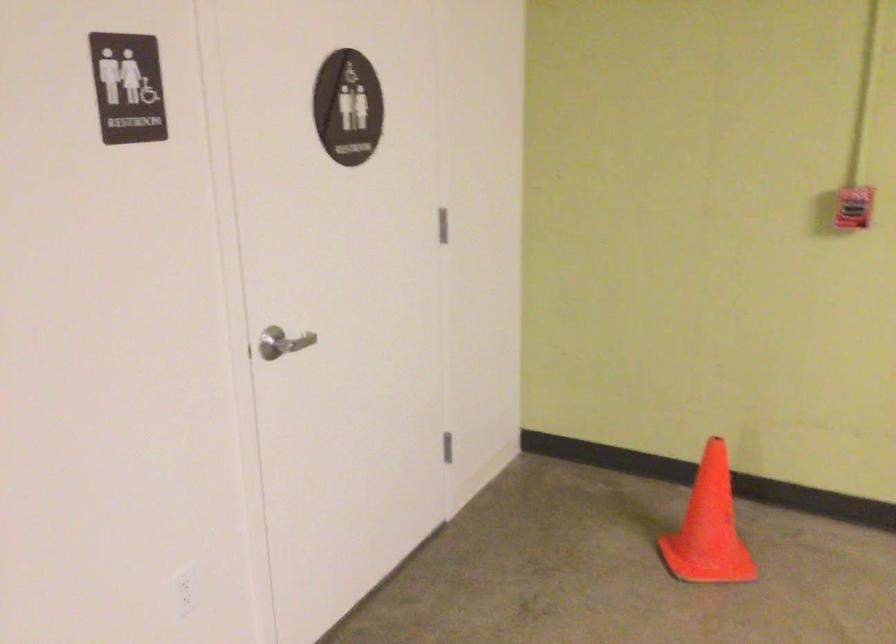
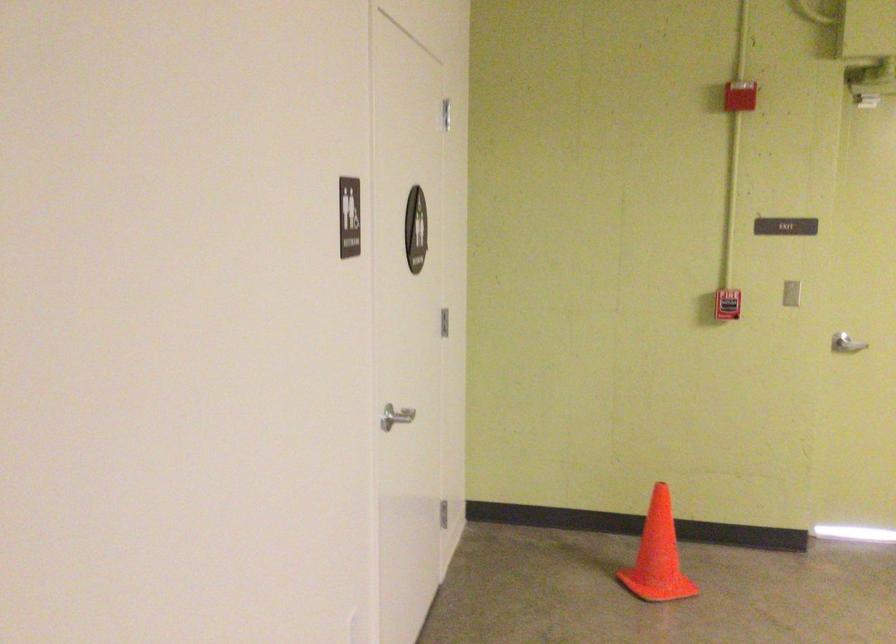
Find the pixel in the second image that matches point (289, 332) in the first image.

(394, 415)